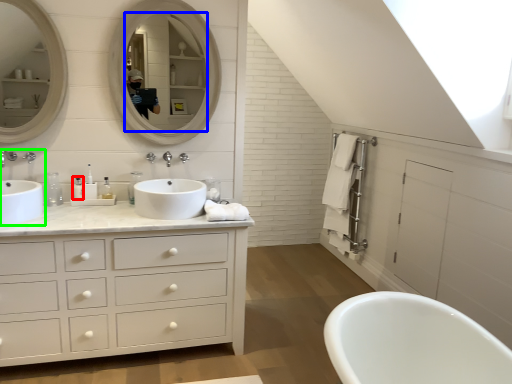
Question: Based on their relative distances, which object is farther from toiletry (highlighted by a red box)? Choose from mirror (highlighted by a blue box) and sink (highlighted by a green box).

Choices:
 (A) mirror
 (B) sink

Answer: (A)